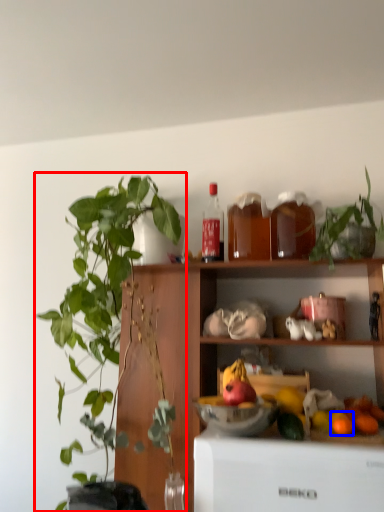
Question: Which of the following is the farthest to the observer, houseplant (highlighted by a red box) or orange (highlighted by a blue box)?

Choices:
 (A) houseplant
 (B) orange

Answer: (B)